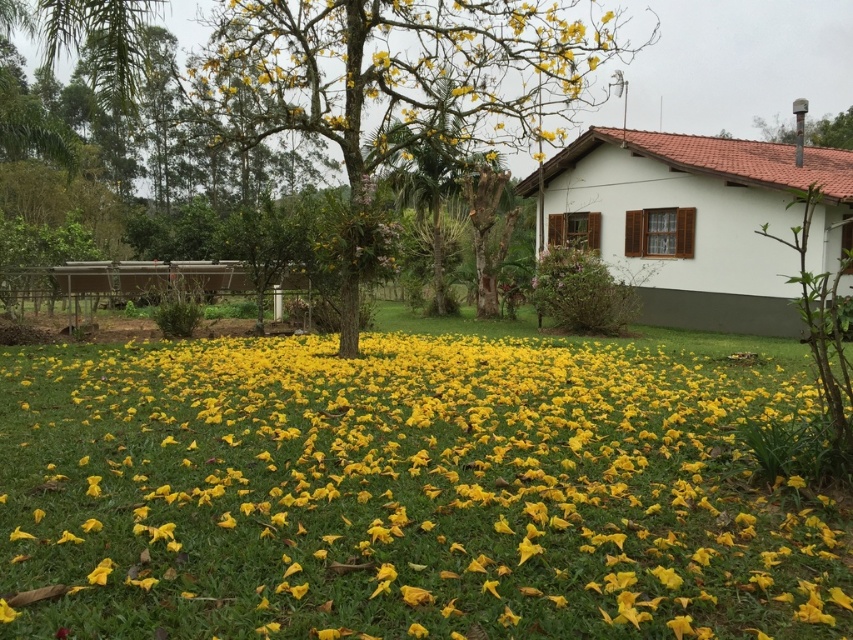
Is yellow leafy tree at center above smooth gray chimney at upper right?

Actually, yellow leafy tree at center is below smooth gray chimney at upper right.

Which is behind, point (440, 113) or point (836, 120)?

Positioned behind is point (836, 120).

Who is more forward, [323,1] or [793,136]?

Point [323,1]

Locate an element on the screen. yellow leafy tree at center is located at coordinates (399, 72).

Can you confirm if yellow matte flower at center is positioned to the left of yellow leafy tree at center?

In fact, yellow matte flower at center is to the right of yellow leafy tree at center.

Who is more forward, (413,568) or (575,93)?

Point (413,568)

The width and height of the screenshot is (853, 640). Find the location of `yellow matte flower at center`. yellow matte flower at center is located at coordinates [x=403, y=493].

Is yellow matte flower at center to the left of smooth gray chimney at upper right from the viewer's perspective?

Correct, you'll find yellow matte flower at center to the left of smooth gray chimney at upper right.

Locate an element on the screen. The height and width of the screenshot is (640, 853). yellow matte flower at center is located at coordinates (403, 493).

This screenshot has height=640, width=853. What are the coordinates of `yellow matte flower at center` in the screenshot? It's located at (403, 493).